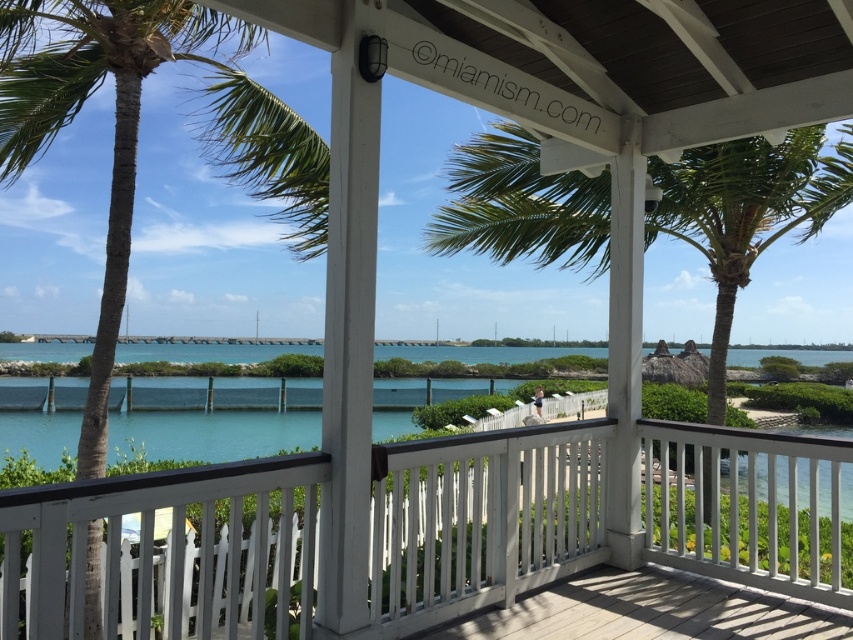
Is white wooden railing at center positioned at the back of green leafy palm tree at center?

No, white wooden railing at center is closer to the viewer.

From the picture: Which of these two, white wooden railing at center or green leafy palm tree at center, stands shorter?

white wooden railing at center

Image resolution: width=853 pixels, height=640 pixels. Identify the location of white wooden railing at center. (169, 552).

Is white wooden railing at center to the right of green leafy palm tree at left from the viewer's perspective?

Correct, you'll find white wooden railing at center to the right of green leafy palm tree at left.

You are a GUI agent. You are given a task and a screenshot of the screen. Output one action in this format:
    pyautogui.click(x=<x>, y=<y>)
    Task: Click on the white wooden railing at center
    This screenshot has height=640, width=853.
    Given the screenshot: What is the action you would take?
    pyautogui.click(x=169, y=552)

From the picture: Does green leafy palm tree at left appear under green leafy palm tree at center?

Actually, green leafy palm tree at left is above green leafy palm tree at center.

Is green leafy palm tree at left bigger than green leafy palm tree at center?

Yes.

Between point (260, 141) and point (518, 136), which one is positioned behind?

The point (518, 136) is more distant.

Where is `green leafy palm tree at left`? green leafy palm tree at left is located at coordinates (128, 122).